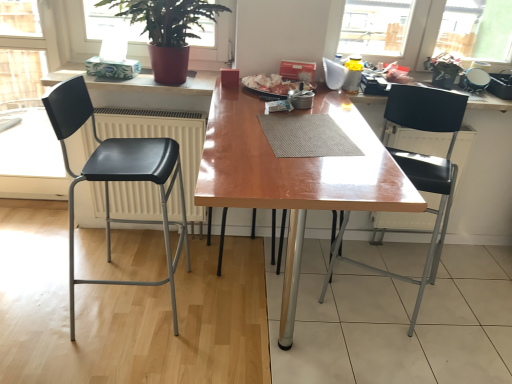
This screenshot has height=384, width=512. In order to click on free space underneath black plastic chair at right, marked as the 1th chair in a right-to-left arrangement (from a real-world perspective) in this screenshot , I will do `click(388, 296)`.